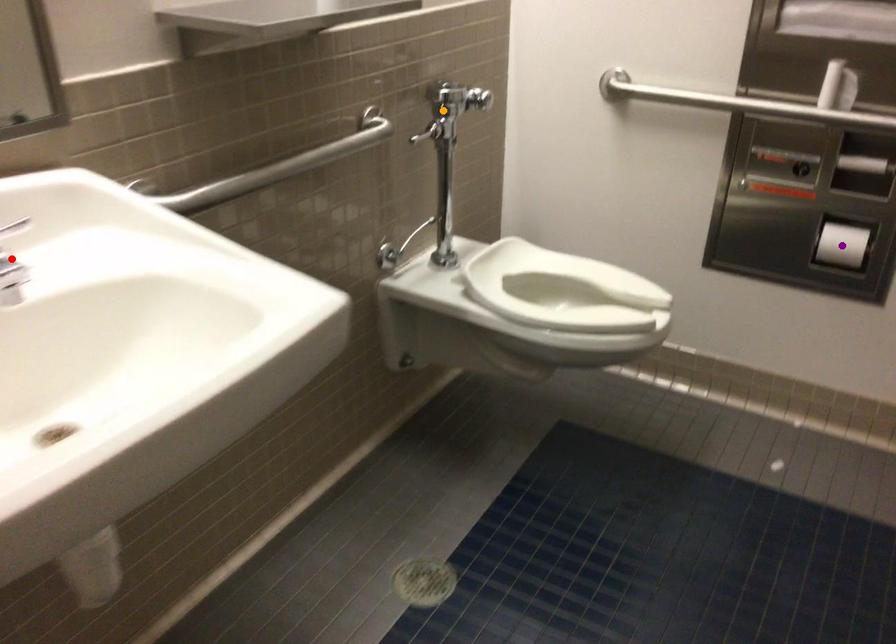
Order these from nearest to farthest:
red point, orange point, purple point

orange point, purple point, red point